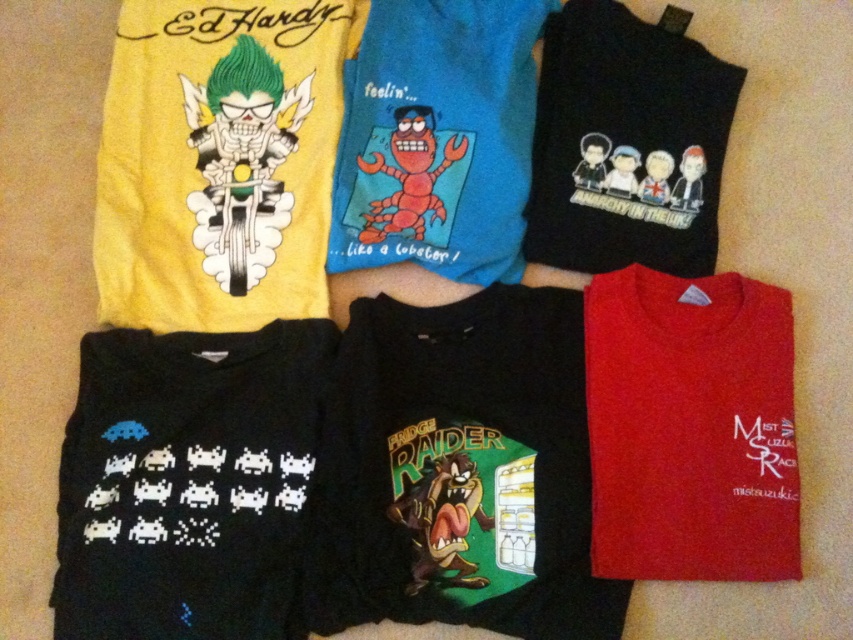
Question: In this image, where is red cotton t-shirt at lower right located relative to blue matte t-shirt at center?

Choices:
 (A) above
 (B) below

Answer: (B)

Question: Which object is closer to the camera taking this photo?

Choices:
 (A) red cotton t-shirt at lower right
 (B) black matte t-shirt at upper right
 (C) black matte t-shirt at center
 (D) blue matte t-shirt at center

Answer: (A)

Question: Which of the following is the closest to the observer?

Choices:
 (A) (372, 442)
 (B) (444, 176)
 (C) (142, 545)
 (D) (676, 60)

Answer: (C)

Question: Which point is farther to the camera?

Choices:
 (A) (587, 225)
 (B) (166, 618)
 (C) (463, 3)

Answer: (A)

Question: Can you confirm if black matte t-shirt at lower left is thinner than red cotton t-shirt at lower right?

Choices:
 (A) no
 (B) yes

Answer: (A)

Question: Does black matte t-shirt at center appear on the left side of blue matte t-shirt at center?

Choices:
 (A) yes
 (B) no

Answer: (B)